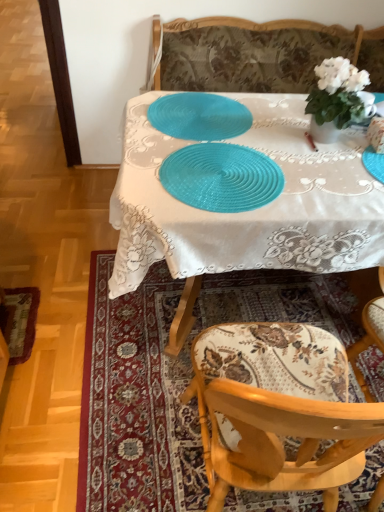
Identify the location of free space between teal plastic placemat at center, which is the second tableware in front-to-back order, and teal woven placemat at center, arranged as the first tableware when viewed from the front. The height and width of the screenshot is (512, 384). (233, 140).